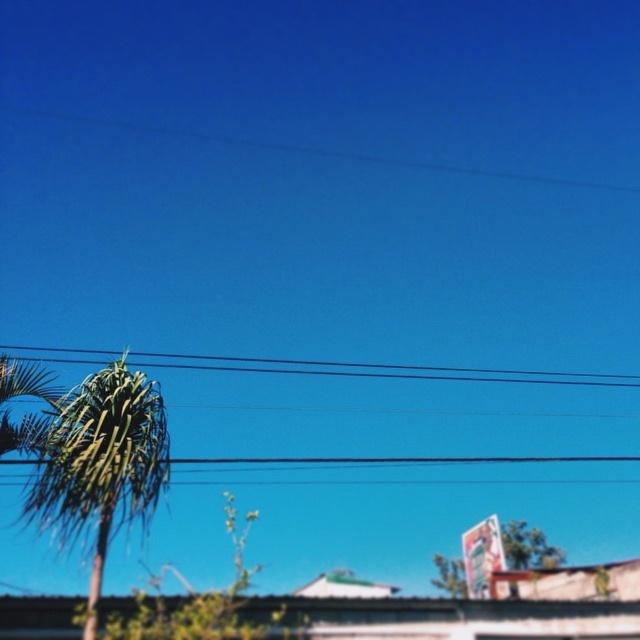
You are standing in the center of the image and want to walk towards the green leafy palm tree at left. In which direction should you move?

You should move to the left because the green leafy palm tree at left is located at point (100, 464), which is to the left of the center position.

You are standing in the middle of the scene and want to walk towards the green leafy palm tree at left and the green leafy tree at lower center. Which tree should you walk towards if you want to reach the wider one first?

The green leafy palm tree at left might be wider than the green leafy tree at lower center, so you should walk towards the green leafy palm tree at left to reach the wider one first.

You are a bird flying towards the green leafy tree at lower center. Which direction should you adjust your flight path to avoid the black wire at upper center?

The black wire at upper center is positioned on the left side of the green leafy tree at lower center. To avoid it, you should adjust your flight path to the right side.